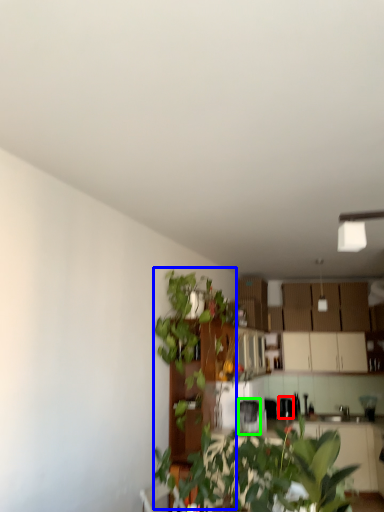
Question: Which object is the farthest from appliance (highlighted by a red box)? Choose among these: vegetation (highlighted by a blue box) or appliance (highlighted by a green box).

Choices:
 (A) vegetation
 (B) appliance

Answer: (A)